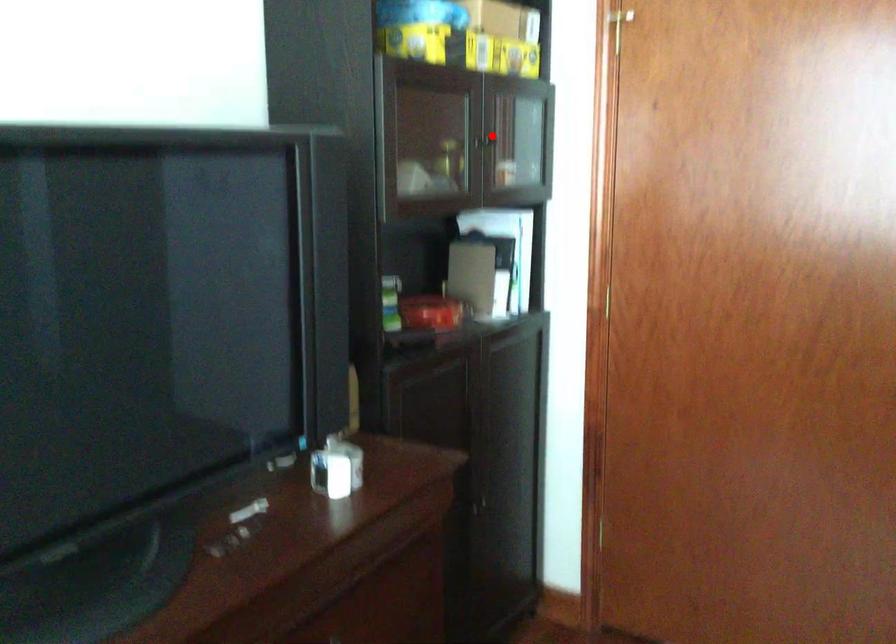
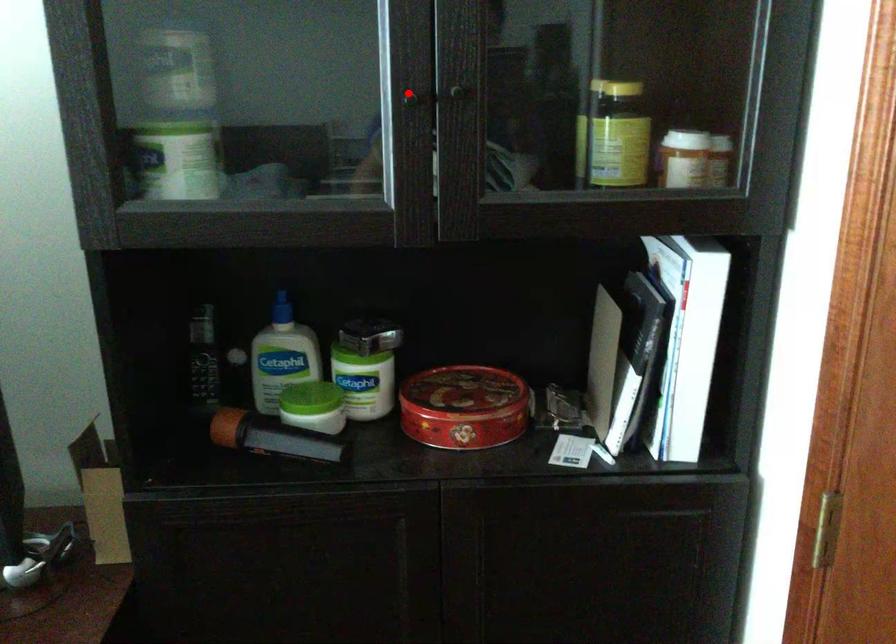
I am providing you with two images of the same scene from different viewpoints. A red point is marked on the first image and another point is marked on the second image. Is the marked point in image1 the same physical position as the marked point in image2?

No